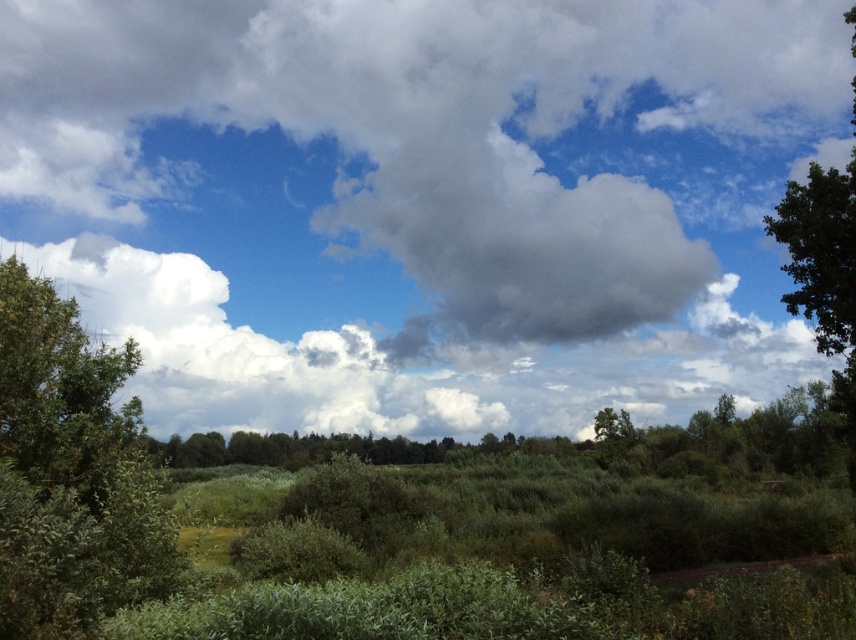
Is green leafy tree at left thinner than green leafy tree at right?

No, green leafy tree at left is not thinner than green leafy tree at right.

Who is higher up, green leafy tree at left or green leafy tree at right?

green leafy tree at right

Is point (147, 554) positioned behind point (821, 186)?

No.

This screenshot has height=640, width=856. I want to click on green leafy tree at left, so click(x=70, y=472).

Where is `white fluffy cloud at upper center`? This screenshot has height=640, width=856. white fluffy cloud at upper center is located at coordinates (421, 202).

Who is positioned more to the left, white fluffy cloud at upper center or green leafy tree at right?

From the viewer's perspective, white fluffy cloud at upper center appears more on the left side.

What do you see at coordinates (421, 202) in the screenshot?
I see `white fluffy cloud at upper center` at bounding box center [421, 202].

Where is `white fluffy cloud at upper center`? This screenshot has height=640, width=856. white fluffy cloud at upper center is located at coordinates (421, 202).

Does white fluffy cloud at upper center have a greater width compared to green leafy tree at left?

Yes, white fluffy cloud at upper center is wider than green leafy tree at left.

The width and height of the screenshot is (856, 640). Describe the element at coordinates (421, 202) in the screenshot. I see `white fluffy cloud at upper center` at that location.

Where is `white fluffy cloud at upper center`? white fluffy cloud at upper center is located at coordinates (421, 202).